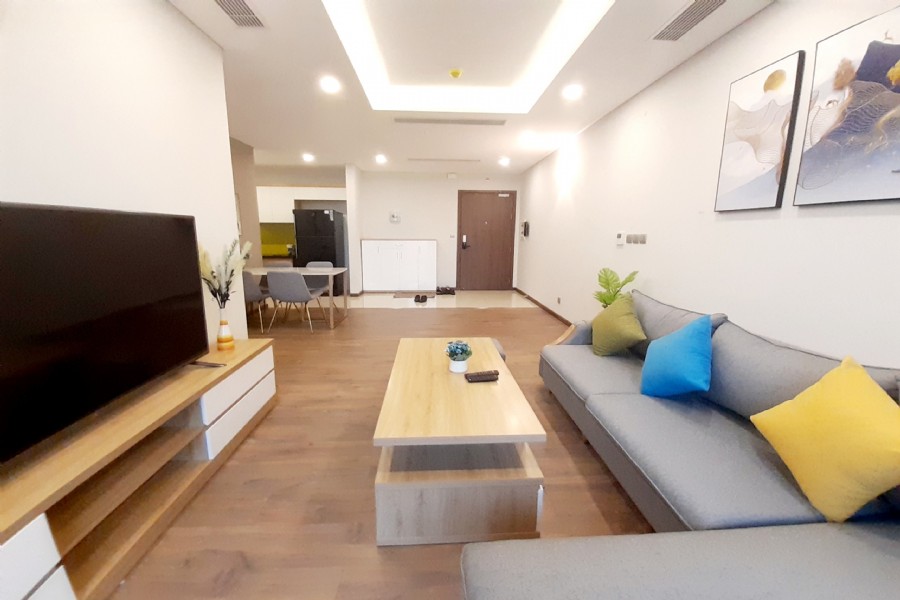
Identify the location of kitchen chair. (291, 287), (254, 292), (320, 263).